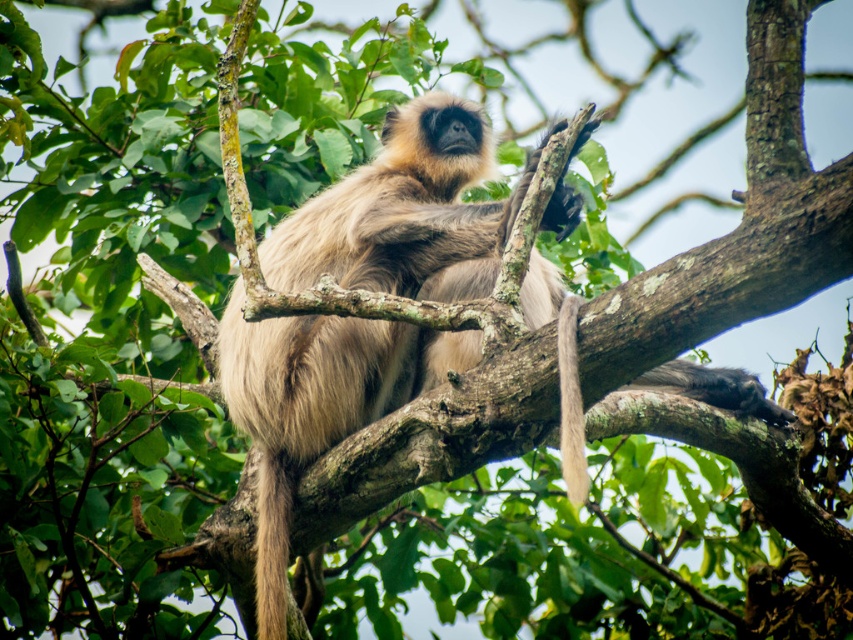
Which is in front, point (457, 355) or point (564, 310)?

Point (564, 310) is more forward.

This screenshot has width=853, height=640. Identify the location of light brown fur monkey at center. (405, 212).

Between fuzzy brown tail at lower left and fuzzy beige tail at center, which one has less height?

Standing shorter between the two is fuzzy beige tail at center.

Does fuzzy brown tail at lower left have a greater width compared to fuzzy beige tail at center?

Yes, fuzzy brown tail at lower left is wider than fuzzy beige tail at center.

The image size is (853, 640). What do you see at coordinates (271, 540) in the screenshot?
I see `fuzzy brown tail at lower left` at bounding box center [271, 540].

The image size is (853, 640). What are the coordinates of `fuzzy brown tail at lower left` in the screenshot? It's located at (271, 540).

This screenshot has height=640, width=853. Describe the element at coordinates (405, 212) in the screenshot. I see `light brown fur monkey at center` at that location.

Is light brown fur monkey at center positioned behind fuzzy brown tail at lower left?

No, light brown fur monkey at center is in front of fuzzy brown tail at lower left.

The height and width of the screenshot is (640, 853). In order to click on light brown fur monkey at center in this screenshot , I will do `click(405, 212)`.

The image size is (853, 640). Find the location of `light brown fur monkey at center`. light brown fur monkey at center is located at coordinates (405, 212).